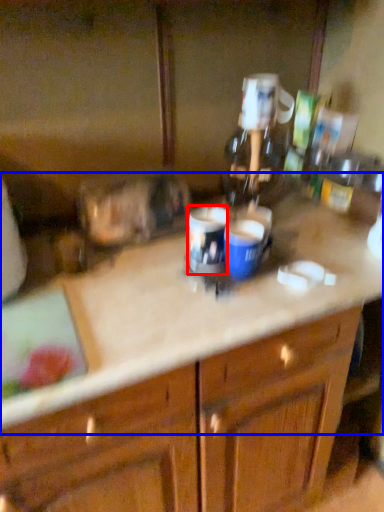
Question: Which of the following is the closest to the observer, beverage (highlighted by a red box) or counter top (highlighted by a blue box)?

Choices:
 (A) beverage
 (B) counter top

Answer: (B)